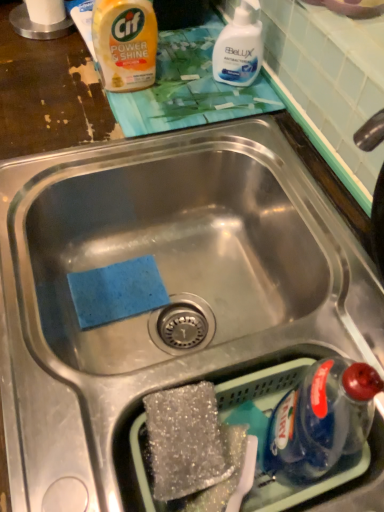
I want to click on blank space to the left of white glossy liquid at upper center, so click(177, 87).